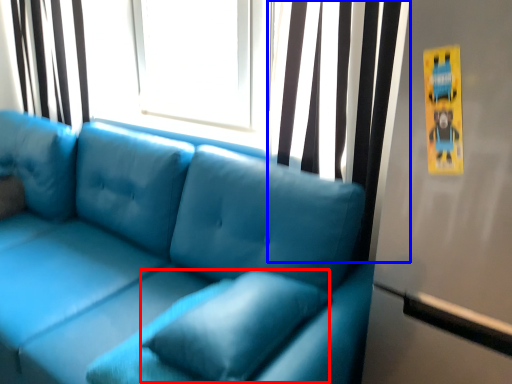
Question: Among these objects, which one is nearest to the camera, pillow (highlighted by a red box) or curtain (highlighted by a blue box)?

Choices:
 (A) pillow
 (B) curtain

Answer: (A)